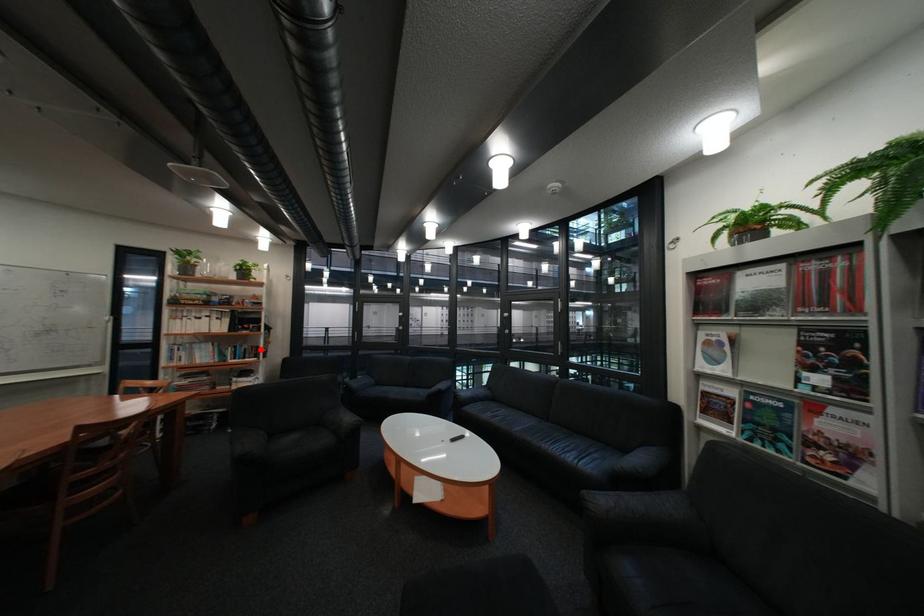
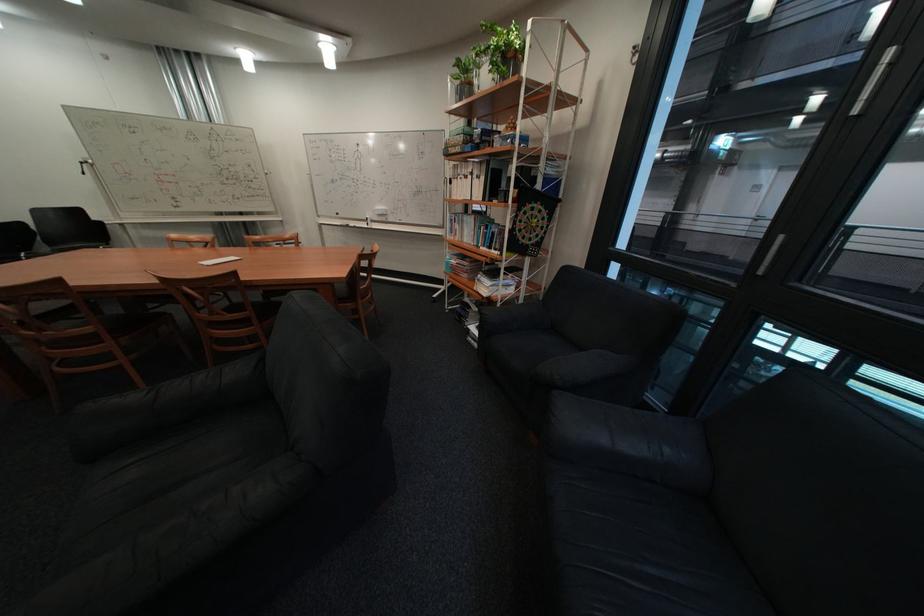
In the second image, find the point that corresponds to the highlighted location in the first image.

(508, 233)